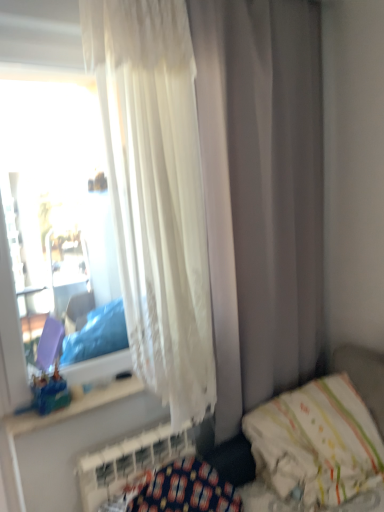
What do you see at coordinates (48, 393) in the screenshot? This screenshot has height=512, width=384. I see `translucent plastic toy at window` at bounding box center [48, 393].

Describe the element at coordinates (316, 442) in the screenshot. I see `white soft pillow at lower right` at that location.

Measure the distance between point (376, 400) and camera.

Point (376, 400) and camera are 1.94 meters apart.

What do you see at coordinates (364, 377) in the screenshot? The width and height of the screenshot is (384, 512). I see `white fabric hospital bed at lower right` at bounding box center [364, 377].

This screenshot has height=512, width=384. Identify the location of translucent plastic toy at window. (48, 393).

Which is less distant, (244, 10) or (61, 383)?

The point (244, 10) is more forward.

Is white sheer curtain at upper left bigger than translucent plastic toy at window?

Correct, white sheer curtain at upper left is larger in size than translucent plastic toy at window.

Which object is further away from the camera taking this photo, white sheer curtain at upper left or translucent plastic toy at window?

translucent plastic toy at window is further from the camera.

Relative to white fabric hospital bed at lower right, is translucent plastic toy at window in front or behind?

In the image, translucent plastic toy at window appears behind white fabric hospital bed at lower right.

Between translucent plastic toy at window and white fabric hospital bed at lower right, which one has smaller width?

With smaller width is translucent plastic toy at window.

From a real-world perspective, is translucent plastic toy at window positioned over white fabric hospital bed at lower right based on gravity?

Yes, from a real-world perspective, translucent plastic toy at window is on top of white fabric hospital bed at lower right.

Between translucent plastic toy at window and white fabric hospital bed at lower right, which one has less height?

translucent plastic toy at window is shorter.

Is translucent plastic toy at window positioned far away from white sheer curtain at upper left?

Yes, translucent plastic toy at window and white sheer curtain at upper left are located far from each other.

Which object is wider, translucent plastic toy at window or white sheer curtain at upper left?

white sheer curtain at upper left.

Between translucent plastic toy at window and white sheer curtain at upper left, which one appears on the right side from the viewer's perspective?

From the viewer's perspective, white sheer curtain at upper left appears more on the right side.

From the image's perspective, does translucent plastic toy at window appear higher than white soft pillow at lower right?

Yes, from the image's perspective, translucent plastic toy at window is above white soft pillow at lower right.

Is the depth of translucent plastic toy at window less than that of white soft pillow at lower right?

No, translucent plastic toy at window is further to the viewer.

Consider the image. How different are the orientations of translucent plastic toy at window and white soft pillow at lower right in degrees?

They differ by 13 degrees in their facing directions.

In terms of height, does translucent plastic toy at window look taller or shorter compared to white soft pillow at lower right?

Clearly, translucent plastic toy at window is shorter compared to white soft pillow at lower right.

Would you say white soft pillow at lower right contains white textured radiator at lower left?

That's incorrect, white textured radiator at lower left is not inside white soft pillow at lower right.

From the image's perspective, is white soft pillow at lower right over white textured radiator at lower left?

Correct, white soft pillow at lower right appears higher than white textured radiator at lower left in the image.

Is white soft pillow at lower right facing away from white textured radiator at lower left?

That's not correct — white soft pillow at lower right is not looking away from white textured radiator at lower left.

From the image's perspective, is translucent plastic toy at window on white textured radiator at lower left?

Yes.

Is point (66, 387) closer to camera compared to point (123, 484)?

No, it is not.

Which object is thinner, translucent plastic toy at window or white textured radiator at lower left?

white textured radiator at lower left is thinner.

Identify the location of pillow that is under the white textured radiator at lower left (from a real-world perspective). The image size is (384, 512). (316, 442).

Can you confirm if white textured radiator at lower left is shorter than white soft pillow at lower right?

Yes.

From the image's perspective, which is above, white textured radiator at lower left or white soft pillow at lower right?

white soft pillow at lower right, from the image's perspective.

Does white textured radiator at lower left turn towards white soft pillow at lower right?

No, white textured radiator at lower left is not facing towards white soft pillow at lower right.

You are a GUI agent. You are given a task and a screenshot of the screen. Output one action in this format:
    pyautogui.click(x=<x>, y=<y>)
    Task: Click on the curtain above the translucent plastic toy at window (from a real-world perspective)
    The width and height of the screenshot is (384, 512).
    Given the screenshot: What is the action you would take?
    pyautogui.click(x=261, y=194)

This screenshot has height=512, width=384. What are the coordinates of `toy lying above the white fabric hospital bed at lower right (from the image's perspective)` in the screenshot? It's located at (48, 393).

Estimate the real-world distances between objects in this image. Which object is closer to translucent plastic toy at window, white sheer curtain at upper left or white textured radiator at lower left?

white textured radiator at lower left.

Which object lies nearer to the anchor point white textured radiator at lower left, white soft pillow at lower right or translucent plastic toy at window?

translucent plastic toy at window is positioned closer to the anchor white textured radiator at lower left.

Looking at the image, which one is located closer to white soft pillow at lower right, white fabric hospital bed at lower right or white sheer curtain at upper left?

white fabric hospital bed at lower right.

When comparing their distances from white fabric hospital bed at lower right, does white textured radiator at lower left or translucent plastic toy at window seem closer?

Based on the image, white textured radiator at lower left appears to be nearer to white fabric hospital bed at lower right.

From the image, which object appears to be farther from white fabric hospital bed at lower right, white textured radiator at lower left or white sheer curtain at upper left?

Among the two, white textured radiator at lower left is located further to white fabric hospital bed at lower right.

When comparing their distances from translucent plastic toy at window, does white textured radiator at lower left or white fabric hospital bed at lower right seem closer?

white textured radiator at lower left lies closer to translucent plastic toy at window than the other object.

Which object lies further to the anchor point translucent plastic toy at window, white fabric hospital bed at lower right or white textured radiator at lower left?

Based on the image, white fabric hospital bed at lower right appears to be further to translucent plastic toy at window.

Looking at the image, which one is located further to white textured radiator at lower left, white fabric hospital bed at lower right or white soft pillow at lower right?

white fabric hospital bed at lower right is further to white textured radiator at lower left.

The height and width of the screenshot is (512, 384). I want to click on pillow between white fabric hospital bed at lower right and white textured radiator at lower left from front to back, so click(316, 442).

What are the coordinates of `hospital bed between white sheer curtain at upper left and white soft pillow at lower right in the vertical direction` in the screenshot? It's located at (364, 377).

Identify the location of radiator between white fabric hospital bed at lower right and translucent plastic toy at window along the z-axis. (136, 459).

At what (x,y) coordinates should I click in order to perform the action: click on pillow between white sheer curtain at upper left and white textured radiator at lower left from top to bottom. Please return your answer as a coordinate pair (x, y). Looking at the image, I should click on (316, 442).